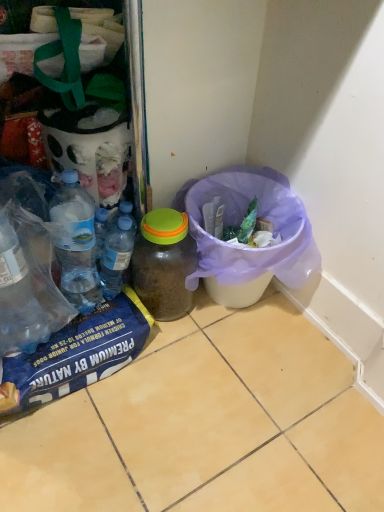
Question: Considering the positions of point (182, 236) and point (273, 202), is point (182, 236) closer or farther from the camera than point (273, 202)?

Choices:
 (A) farther
 (B) closer

Answer: (B)

Question: From the image's perspective, relative to purple fabric bag at lower right, is translucent plastic jar at center, positioned as the 2th bottle in left-to-right order, above or below?

Choices:
 (A) above
 (B) below

Answer: (B)

Question: Which object is the closest to the translucent plastic jar at center, positioned as the 2th bottle in left-to-right order?

Choices:
 (A) translucent plastic bottles at center, which ranks as the 2th bottle in right-to-left order
 (B) purple fabric bag at lower right

Answer: (A)

Question: Considering the real-world distances, which object is farthest from the translucent plastic bottles at center, which ranks as the 2th bottle in right-to-left order?

Choices:
 (A) purple fabric bag at lower right
 (B) translucent plastic jar at center, positioned as the 2th bottle in left-to-right order

Answer: (A)